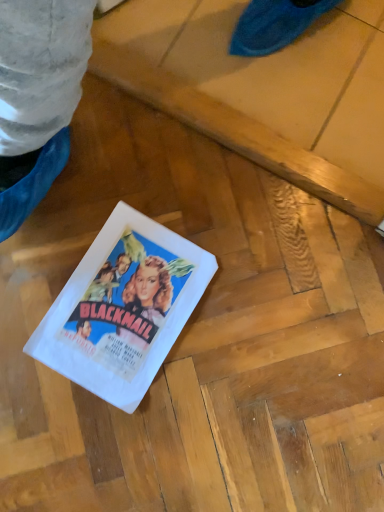
Locate an element on the screen. vacant space situated on the left part of white matte book at center is located at coordinates (39, 264).